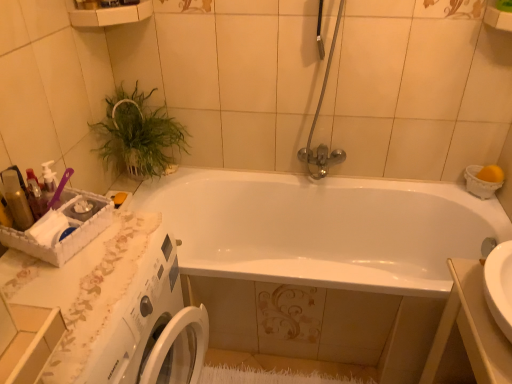
Question: From a real-world perspective, is white glossy bathtub at center on white glossy sink at lower right?

Choices:
 (A) no
 (B) yes

Answer: (A)

Question: Would you say white glossy bathtub at center contains white glossy sink at lower right?

Choices:
 (A) no
 (B) yes

Answer: (A)

Question: From a real-world perspective, does white glossy bathtub at center sit lower than white glossy sink at lower right?

Choices:
 (A) yes
 (B) no

Answer: (A)

Question: Is white glossy bathtub at center taller than white glossy sink at lower right?

Choices:
 (A) no
 (B) yes

Answer: (A)

Question: Is white glossy bathtub at center touching white glossy sink at lower right?

Choices:
 (A) no
 (B) yes

Answer: (A)

Question: Would you say shiny plastic bottles at left is to the left or to the right of white glossy bathtub at center in the picture?

Choices:
 (A) left
 (B) right

Answer: (A)

Question: Based on their sizes in the image, would you say shiny plastic bottles at left is bigger or smaller than white glossy bathtub at center?

Choices:
 (A) small
 (B) big

Answer: (A)

Question: Considering the positions of shiny plastic bottles at left and white glossy bathtub at center in the image, is shiny plastic bottles at left taller or shorter than white glossy bathtub at center?

Choices:
 (A) short
 (B) tall

Answer: (A)

Question: Which is correct: shiny plastic bottles at left is inside white glossy bathtub at center, or outside of it?

Choices:
 (A) outside
 (B) inside

Answer: (A)

Question: Does point (27, 266) appear closer or farther from the camera than point (102, 145)?

Choices:
 (A) closer
 (B) farther

Answer: (A)

Question: Do you think white lace counter top at lower left is within green leafy plant at upper left, or outside of it?

Choices:
 (A) inside
 (B) outside

Answer: (B)

Question: Is white lace counter top at lower left wider or thinner than green leafy plant at upper left?

Choices:
 (A) wide
 (B) thin

Answer: (A)

Question: From the image's perspective, is white lace counter top at lower left positioned above or below green leafy plant at upper left?

Choices:
 (A) above
 (B) below

Answer: (B)

Question: From the image's perspective, is white glossy sink at lower right positioned above or below green leafy plant at upper left?

Choices:
 (A) below
 (B) above

Answer: (A)

Question: Is point (478, 279) positioned closer to the camera than point (142, 117)?

Choices:
 (A) farther
 (B) closer

Answer: (B)